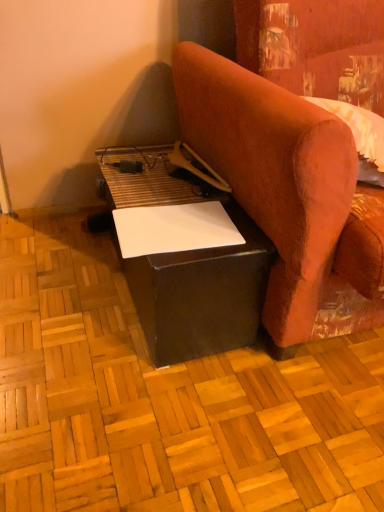
The width and height of the screenshot is (384, 512). Identify the location of vacant point above white paper at lower center (from a real-world perspective). (174, 223).